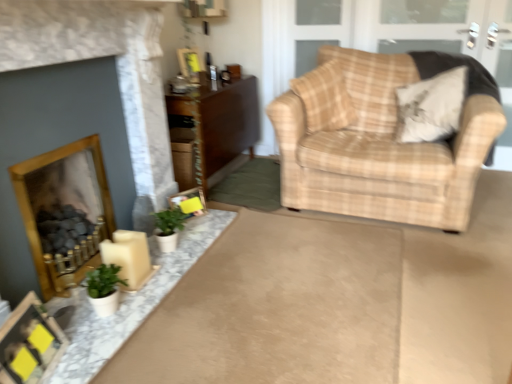
The width and height of the screenshot is (512, 384). Identify the location of unoccupied area in front of matte yellow picture frame at lower center, the second picture frame viewed from the front. (193, 226).